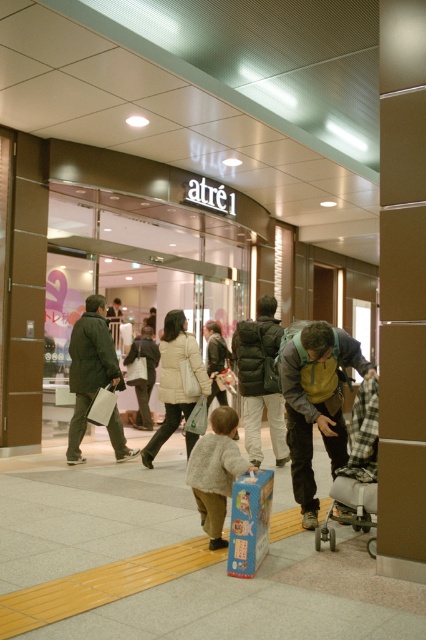
Question: Where is light gray wool sweater at center located in relation to beige puffy coat at center in the image?

Choices:
 (A) below
 (B) above

Answer: (A)

Question: Is the position of light gray wool sweater at center less distant than that of beige puffy coat at center?

Choices:
 (A) no
 (B) yes

Answer: (B)

Question: Considering the relative positions of yellow backpack at lower right and beige puffy coat at center in the image provided, where is yellow backpack at lower right located with respect to beige puffy coat at center?

Choices:
 (A) right
 (B) left

Answer: (A)

Question: Which point is farther to the camera?

Choices:
 (A) (236, 420)
 (B) (118, 369)
 (C) (276, 460)
 (D) (178, 420)

Answer: (C)

Question: Which point is farther to the camera?

Choices:
 (A) (293, 429)
 (B) (271, 433)
 (C) (115, 436)
 (D) (201, 464)

Answer: (C)

Question: Estimate the real-world distances between objects in this image. Which object is farther from the yellow backpack at lower right?

Choices:
 (A) beige puffy coat at center
 (B) matte black puffer jacket at center
 (C) dark green jacket at left

Answer: (C)